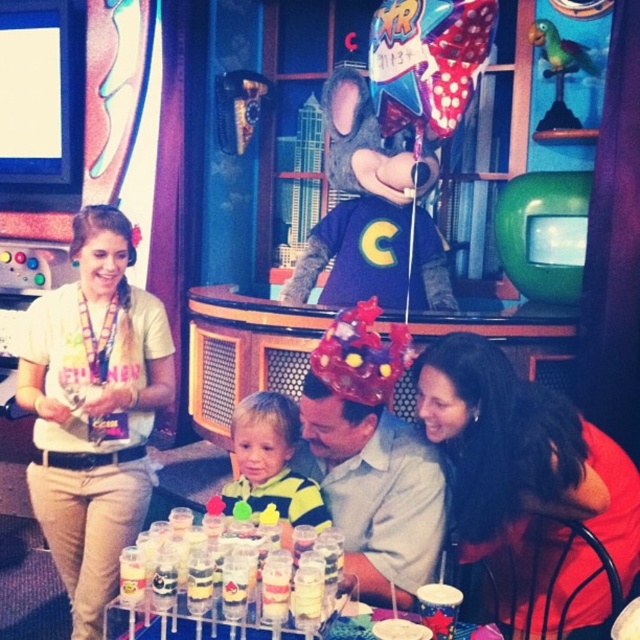
You are at a birthday party and see two shirts in the scene. The white cotton shirt at left and the matte red shirt at lower right. Which shirt is positioned higher up in the image?

The white cotton shirt at left is located above the matte red shirt at lower right, so it is positioned higher up in the image.

You are a photographer trying to capture a closeup shot of the matte plastic hat at center without the striped fabric shirt at center blocking the view. Is this possible given their positions?

The matte plastic hat at center is closer to the viewer than the striped fabric shirt at center, so yes, you can take a closeup of the matte plastic hat at center without the striped fabric shirt at center blocking the view since it is behind the hat.